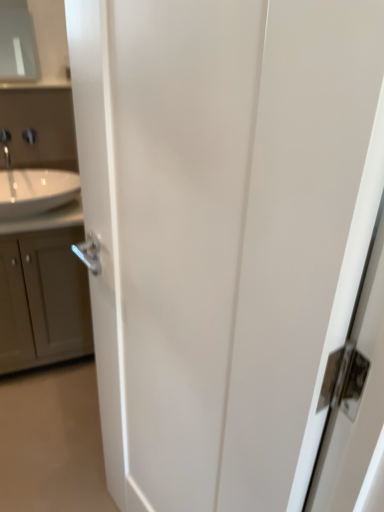
Question: Can you confirm if satin nickel faucet at upper left is smaller than silver metallic tap at upper left?

Choices:
 (A) yes
 (B) no

Answer: (A)

Question: Can you confirm if satin nickel faucet at upper left is taller than silver metallic tap at upper left?

Choices:
 (A) yes
 (B) no

Answer: (A)

Question: Could you tell me if satin nickel faucet at upper left is turned towards silver metallic tap at upper left?

Choices:
 (A) no
 (B) yes

Answer: (A)

Question: Is satin nickel faucet at upper left directly adjacent to silver metallic tap at upper left?

Choices:
 (A) no
 (B) yes

Answer: (B)

Question: From a real-world perspective, is satin nickel faucet at upper left on top of silver metallic tap at upper left?

Choices:
 (A) no
 (B) yes

Answer: (A)

Question: Are satin nickel faucet at upper left and silver metallic tap at upper left far apart?

Choices:
 (A) yes
 (B) no

Answer: (B)

Question: From the image's perspective, is matte gray medicine cabinet at upper left below silver metallic tap at upper left?

Choices:
 (A) yes
 (B) no

Answer: (B)

Question: Considering the relative sizes of matte gray medicine cabinet at upper left and silver metallic tap at upper left in the image provided, is matte gray medicine cabinet at upper left wider than silver metallic tap at upper left?

Choices:
 (A) yes
 (B) no

Answer: (B)

Question: Is matte gray medicine cabinet at upper left shorter than silver metallic tap at upper left?

Choices:
 (A) no
 (B) yes

Answer: (A)

Question: Is matte gray medicine cabinet at upper left closer to camera compared to silver metallic tap at upper left?

Choices:
 (A) yes
 (B) no

Answer: (B)

Question: Would you say matte gray medicine cabinet at upper left is outside silver metallic tap at upper left?

Choices:
 (A) yes
 (B) no

Answer: (A)

Question: Is matte gray medicine cabinet at upper left to the right of silver metallic tap at upper left from the viewer's perspective?

Choices:
 (A) yes
 (B) no

Answer: (B)

Question: Does white glossy sink at left turn towards silver metallic tap at upper left?

Choices:
 (A) no
 (B) yes

Answer: (A)